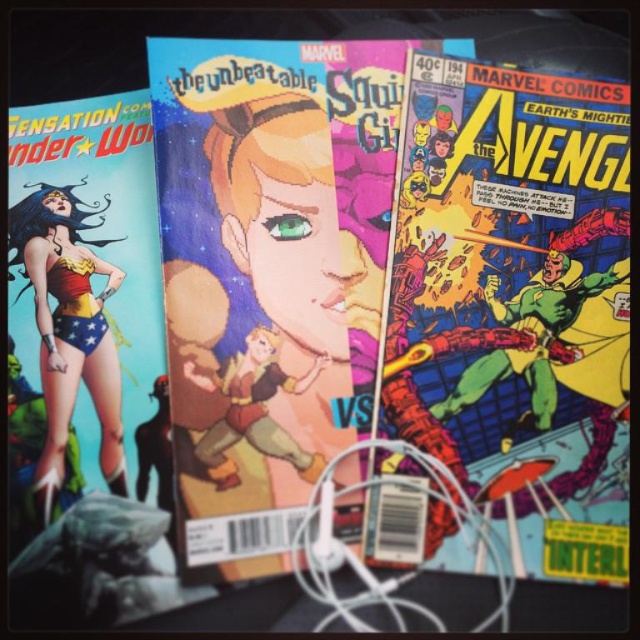
Question: Among these objects, which one is nearest to the camera?

Choices:
 (A) shiny red and gold costume at left
 (B) multicolored comic book at center

Answer: (B)

Question: Is multicolored comic book at center positioned behind shiny red and gold costume at left?

Choices:
 (A) no
 (B) yes

Answer: (A)

Question: Among these points, which one is nearest to the camera?

Choices:
 (A) (65, 268)
 (B) (532, 368)

Answer: (B)

Question: Is multicolored comic book at center below shiny red and gold costume at left?

Choices:
 (A) no
 (B) yes

Answer: (A)

Question: Does multicolored comic book at center appear on the right side of shiny red and gold costume at left?

Choices:
 (A) no
 (B) yes

Answer: (B)